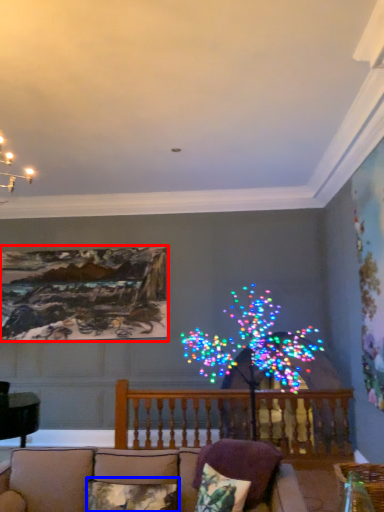
Question: Which object is closer to the camera taking this photo, picture frame (highlighted by a red box) or pillow (highlighted by a blue box)?

Choices:
 (A) picture frame
 (B) pillow

Answer: (B)